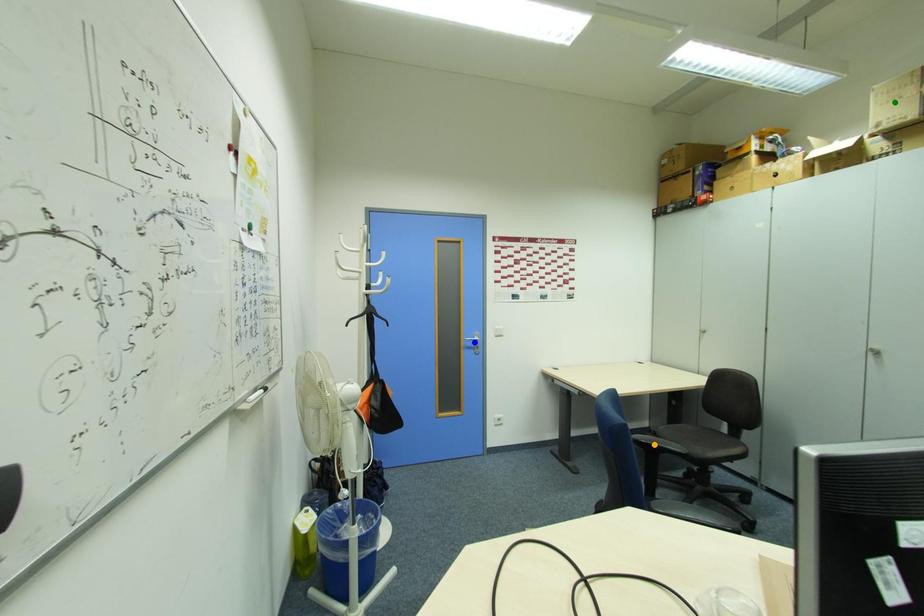
Order these from farthest to nearest:
green point
blue point
orange point

orange point < blue point < green point